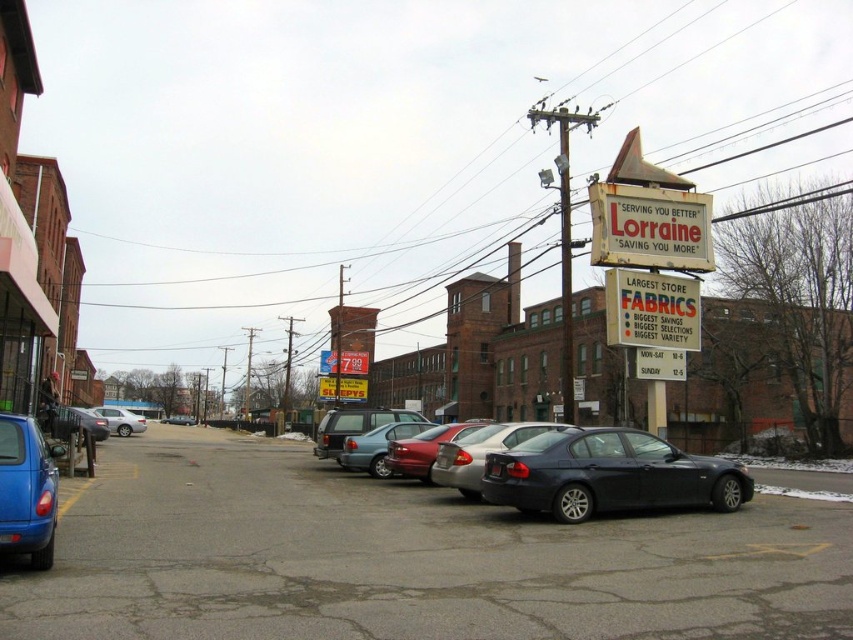
Who is positioned more to the left, shiny black sedan at center or silver metallic sedan at center-left?

silver metallic sedan at center-left is more to the left.

Who is more forward, (444, 449) or (132, 413)?

Positioned in front is point (444, 449).

The image size is (853, 640). What are the coordinates of `shiny black sedan at center` in the screenshot? It's located at (479, 452).

I want to click on shiny black sedan at center, so click(479, 452).

Is shiny black sedan at center taller than metallic red sedan at center?

Correct, shiny black sedan at center is much taller as metallic red sedan at center.

Does point (453, 444) come behind point (374, 465)?

No, it is not.

Measure the distance between shiny black sedan at center and camera.

The distance of shiny black sedan at center from camera is 13.12 meters.

Identify the location of shiny black sedan at center. (479, 452).

Does wooden signboard at upper right appear on the right side of shiny red sedan at center?

Yes, wooden signboard at upper right is to the right of shiny red sedan at center.

Can you confirm if wooden signboard at upper right is taller than shiny red sedan at center?

No.

The width and height of the screenshot is (853, 640). Identify the location of wooden signboard at upper right. (650, 227).